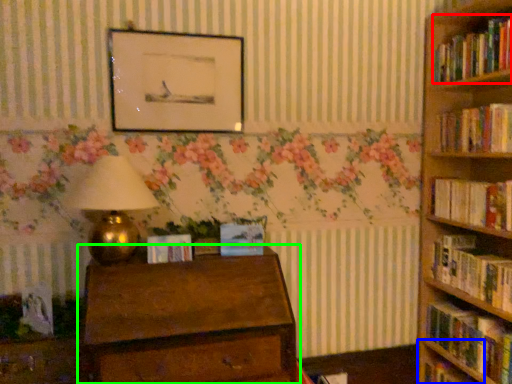
Question: Which object is positioned farthest from book (highlighted by a red box)? Select from shelf (highlighted by a blue box) and chest of drawers (highlighted by a green box).

Choices:
 (A) shelf
 (B) chest of drawers

Answer: (B)